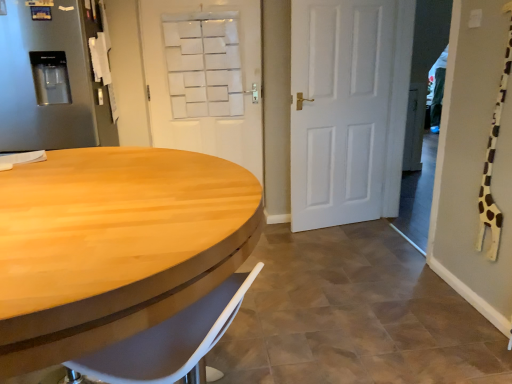
What do you see at coordinates (204, 77) in the screenshot? I see `white matte door at upper center, which is the 1th door from left to right` at bounding box center [204, 77].

Measure the distance between white matte door at upper center, which is counted as the second door, starting from the right, and camera.

They are 9.58 feet apart.

Locate an element on the screen. light wood/wooden table at left is located at coordinates (114, 245).

Where is `white matte door at center, which is the first door in right-to-left order`? The height and width of the screenshot is (384, 512). white matte door at center, which is the first door in right-to-left order is located at coordinates (339, 109).

Which of these two, light wood/wooden table at left or satin silver refrigerator at left, is bigger?

With larger size is light wood/wooden table at left.

Can you confirm if light wood/wooden table at left is thinner than satin silver refrigerator at left?

In fact, light wood/wooden table at left might be wider than satin silver refrigerator at left.

Image resolution: width=512 pixels, height=384 pixels. Find the location of `desk that appears below the satin silver refrigerator at left (from a real-world perspective)`. desk that appears below the satin silver refrigerator at left (from a real-world perspective) is located at coordinates (114, 245).

Considering the relative positions of light wood/wooden table at left and satin silver refrigerator at left in the image provided, is light wood/wooden table at left in front of satin silver refrigerator at left?

Yes, it is.

Does light wood/wooden table at left have a greater width compared to white matte door at center, which is the first door in right-to-left order?

Yes, light wood/wooden table at left is wider than white matte door at center, which is the first door in right-to-left order.

From a real-world perspective, is light wood/wooden table at left located beneath white matte door at center, placed as the second door when sorted from left to right?

Correct, in the physical world, light wood/wooden table at left is lower than white matte door at center, placed as the second door when sorted from left to right.

Based on their positions, is light wood/wooden table at left located to the left or right of white matte door at center, placed as the second door when sorted from left to right?

From the image, it's evident that light wood/wooden table at left is to the left of white matte door at center, placed as the second door when sorted from left to right.

Is white matte door at upper center, which is counted as the second door, starting from the right, surrounding satin silver refrigerator at left?

No, satin silver refrigerator at left is not inside white matte door at upper center, which is counted as the second door, starting from the right.

Is white matte door at upper center, which is counted as the second door, starting from the right, oriented away from satin silver refrigerator at left?

white matte door at upper center, which is counted as the second door, starting from the right, is not turned away from satin silver refrigerator at left.

Is white matte door at upper center, which is the 1th door from left to right, next to satin silver refrigerator at left?

white matte door at upper center, which is the 1th door from left to right, and satin silver refrigerator at left are clearly separated.

Are white matte door at center, which is the first door in right-to-left order, and white matte door at upper center, which is counted as the second door, starting from the right, located far from each other?

No, white matte door at center, which is the first door in right-to-left order, is in close proximity to white matte door at upper center, which is counted as the second door, starting from the right.

Could you tell me if white matte door at center, which is the first door in right-to-left order, is turned towards white matte door at upper center, which is counted as the second door, starting from the right?

No, white matte door at center, which is the first door in right-to-left order, is not aimed at white matte door at upper center, which is counted as the second door, starting from the right.

Is white matte door at center, placed as the second door when sorted from left to right, closer to camera compared to white matte door at upper center, which is the 1th door from left to right?

Yes, it is in front of white matte door at upper center, which is the 1th door from left to right.

Which is closer, [48,43] or [248,104]?

Point [48,43] is positioned closer to the camera compared to point [248,104].

From a real-world perspective, is satin silver refrigerator at left located beneath white matte door at upper center, which is the 1th door from left to right?

No, from a real-world perspective, satin silver refrigerator at left is not under white matte door at upper center, which is the 1th door from left to right.

In terms of height, does satin silver refrigerator at left look taller or shorter compared to white matte door at upper center, which is counted as the second door, starting from the right?

In the image, satin silver refrigerator at left appears to be shorter than white matte door at upper center, which is counted as the second door, starting from the right.

Considering the sizes of objects satin silver refrigerator at left and white matte door at upper center, which is counted as the second door, starting from the right, in the image provided, who is wider, satin silver refrigerator at left or white matte door at upper center, which is counted as the second door, starting from the right,?

Wider between the two is satin silver refrigerator at left.

How different are the orientations of satin silver refrigerator at left and light wood/wooden table at left in degrees?

91.4 degrees.

Is satin silver refrigerator at left positioned with its back to light wood/wooden table at left?

No, satin silver refrigerator at left is not facing the opposite direction of light wood/wooden table at left.

Considering the positions of objects satin silver refrigerator at left and light wood/wooden table at left in the image provided, who is more to the left, satin silver refrigerator at left or light wood/wooden table at left?

From the viewer's perspective, satin silver refrigerator at left appears more on the left side.

This screenshot has height=384, width=512. What are the coordinates of `refrigerator on the left side of light wood/wooden table at left` in the screenshot? It's located at (51, 78).

Would you consider white matte door at upper center, which is counted as the second door, starting from the right, to be distant from white matte door at center, placed as the second door when sorted from left to right?

white matte door at upper center, which is counted as the second door, starting from the right, is near white matte door at center, placed as the second door when sorted from left to right, not far away.

Which object is further away from the camera, white matte door at upper center, which is the 1th door from left to right, or white matte door at center, placed as the second door when sorted from left to right?

white matte door at upper center, which is the 1th door from left to right, is more distant.

Looking at this image, is white matte door at upper center, which is counted as the second door, starting from the right, not inside white matte door at center, placed as the second door when sorted from left to right?

Yes, white matte door at upper center, which is counted as the second door, starting from the right, is not within white matte door at center, placed as the second door when sorted from left to right.

Find the location of a particular element. This screenshot has width=512, height=384. refrigerator behind the light wood/wooden table at left is located at coordinates (51, 78).

The height and width of the screenshot is (384, 512). I want to click on door that is the 2nd one when counting rightward from the light wood/wooden table at left, so click(339, 109).

Based on their spatial positions, is satin silver refrigerator at left or white matte door at center, placed as the second door when sorted from left to right, further from light wood/wooden table at left?

white matte door at center, placed as the second door when sorted from left to right, is positioned further to the anchor light wood/wooden table at left.

Considering their positions, is satin silver refrigerator at left positioned further to light wood/wooden table at left than white matte door at upper center, which is the 1th door from left to right?

Among the two, white matte door at upper center, which is the 1th door from left to right, is located further to light wood/wooden table at left.

From the image, which object appears to be farther from white matte door at upper center, which is the 1th door from left to right, satin silver refrigerator at left or light wood/wooden table at left?

light wood/wooden table at left lies further to white matte door at upper center, which is the 1th door from left to right, than the other object.

Which object lies nearer to the anchor point satin silver refrigerator at left, white matte door at upper center, which is counted as the second door, starting from the right, or light wood/wooden table at left?

Based on the image, white matte door at upper center, which is counted as the second door, starting from the right, appears to be nearer to satin silver refrigerator at left.

Considering their positions, is light wood/wooden table at left positioned further to white matte door at upper center, which is the 1th door from left to right, than white matte door at center, which is the first door in right-to-left order?

Based on the image, light wood/wooden table at left appears to be further to white matte door at upper center, which is the 1th door from left to right.

Based on their spatial positions, is white matte door at upper center, which is the 1th door from left to right, or white matte door at center, which is the first door in right-to-left order, further from light wood/wooden table at left?

Among the two, white matte door at upper center, which is the 1th door from left to right, is located further to light wood/wooden table at left.

When comparing their distances from light wood/wooden table at left, does white matte door at upper center, which is counted as the second door, starting from the right, or satin silver refrigerator at left seem closer?

The object closer to light wood/wooden table at left is satin silver refrigerator at left.

Considering their positions, is satin silver refrigerator at left positioned further to white matte door at center, which is the first door in right-to-left order, than white matte door at upper center, which is the 1th door from left to right?

Among the two, satin silver refrigerator at left is located further to white matte door at center, which is the first door in right-to-left order.

Where is `door between satin silver refrigerator at left and white matte door at center, placed as the second door when sorted from left to right, from left to right`? door between satin silver refrigerator at left and white matte door at center, placed as the second door when sorted from left to right, from left to right is located at coordinates (204, 77).

Locate an element on the screen. This screenshot has width=512, height=384. refrigerator between light wood/wooden table at left and white matte door at center, which is the first door in right-to-left order, from front to back is located at coordinates (51, 78).

At what (x,y) coordinates should I click in order to perform the action: click on door between light wood/wooden table at left and white matte door at upper center, which is the 1th door from left to right, in the front-back direction. Please return your answer as a coordinate pair (x, y). The height and width of the screenshot is (384, 512). Looking at the image, I should click on (339, 109).

I want to click on refrigerator located between light wood/wooden table at left and white matte door at upper center, which is counted as the second door, starting from the right, in the depth direction, so click(51, 78).